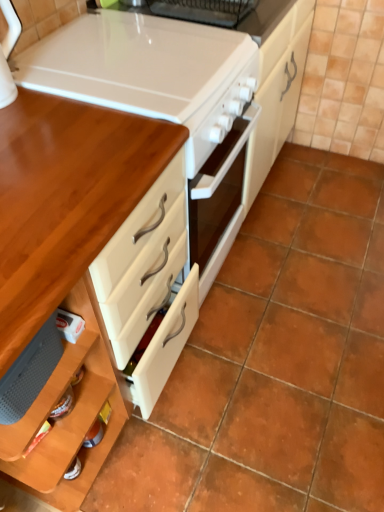
Where is `free space above wooden table at left (from a real-world perspective)`? Image resolution: width=384 pixels, height=512 pixels. free space above wooden table at left (from a real-world perspective) is located at coordinates (55, 173).